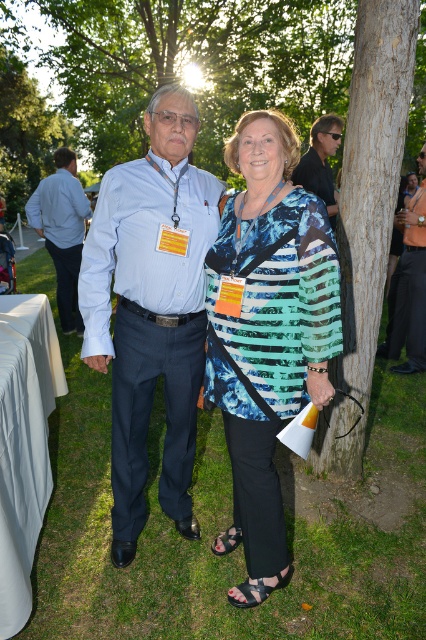
Consider the image. Which of these two, printed fabric top at center or brown rough bark tree at center right, stands shorter?

Standing shorter between the two is printed fabric top at center.

At what (x,y) coordinates should I click in order to perform the action: click on printed fabric top at center. Please return your answer as a coordinate pair (x, y). The width and height of the screenshot is (426, 640). Looking at the image, I should click on coord(267,332).

Is printed fabric top at center below matte blue shirt at left?

Indeed, printed fabric top at center is positioned under matte blue shirt at left.

Is printed fabric top at center smaller than matte blue shirt at left?

Correct, printed fabric top at center occupies less space than matte blue shirt at left.

Describe the element at coordinates (267, 332) in the screenshot. The height and width of the screenshot is (640, 426). I see `printed fabric top at center` at that location.

You are a GUI agent. You are given a task and a screenshot of the screen. Output one action in this format:
    pyautogui.click(x=<x>, y=<y>)
    Task: Click on the printed fabric top at center
    This screenshot has width=426, height=640.
    Given the screenshot: What is the action you would take?
    pyautogui.click(x=267, y=332)

Is printed fabric top at center shorter than matte black sunglasses at upper center?

No, printed fabric top at center is not shorter than matte black sunglasses at upper center.

The height and width of the screenshot is (640, 426). What are the coordinates of `printed fabric top at center` in the screenshot? It's located at (267, 332).

This screenshot has height=640, width=426. I want to click on printed fabric top at center, so click(x=267, y=332).